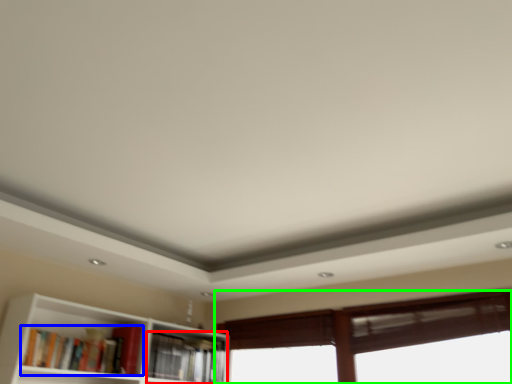
Question: Based on their relative distances, which object is nearer to book (highlighted by a red box)? Choose from book (highlighted by a blue box) and window (highlighted by a green box).

Choices:
 (A) book
 (B) window

Answer: (A)